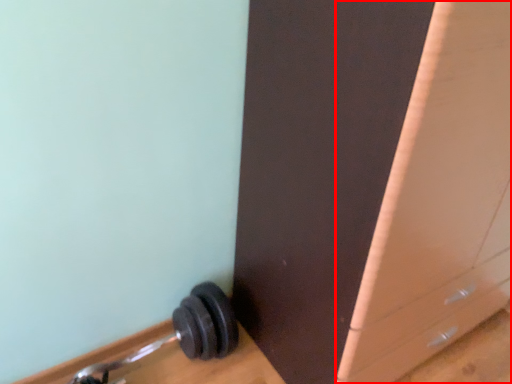
Question: Observing the image, what is the correct spatial positioning of file cabinet (annotated by the red box) in reference to dumbbell?

Choices:
 (A) right
 (B) left

Answer: (A)